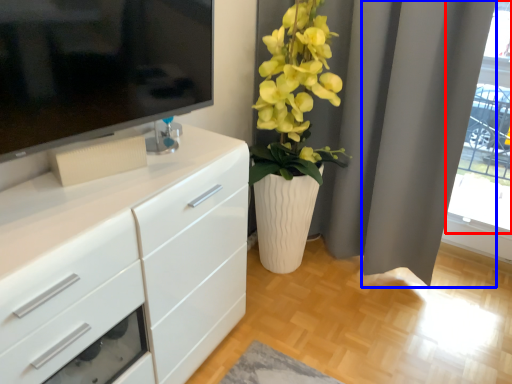
Question: Which of the following is the closest to the observer, glass door (highlighted by a red box) or curtain (highlighted by a blue box)?

Choices:
 (A) glass door
 (B) curtain

Answer: (B)